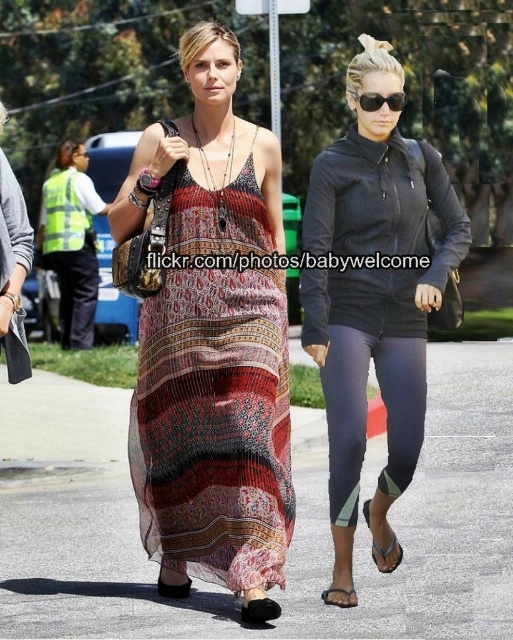
Question: Can you confirm if printed chiffon dress at center is wider than printed chiffon maxi dress at center?

Choices:
 (A) yes
 (B) no

Answer: (A)

Question: Which object appears closest to the camera in this image?

Choices:
 (A) black plastic sunglasses at upper center
 (B) printed chiffon maxi dress at center
 (C) printed chiffon dress at center
 (D) dark blue leggings at lower right

Answer: (B)

Question: Which point is farther to the camera?

Choices:
 (A) black plastic sunglasses at upper center
 (B) printed chiffon maxi dress at center

Answer: (A)

Question: Is printed chiffon dress at center to the left of printed chiffon maxi dress at center from the viewer's perspective?

Choices:
 (A) yes
 (B) no

Answer: (A)

Question: Which of the following is the farthest from the observer?

Choices:
 (A) printed chiffon dress at center
 (B) dark blue leggings at lower right

Answer: (A)

Question: From the image, what is the correct spatial relationship of printed chiffon maxi dress at center in relation to black plastic sunglasses at upper center?

Choices:
 (A) below
 (B) above

Answer: (A)